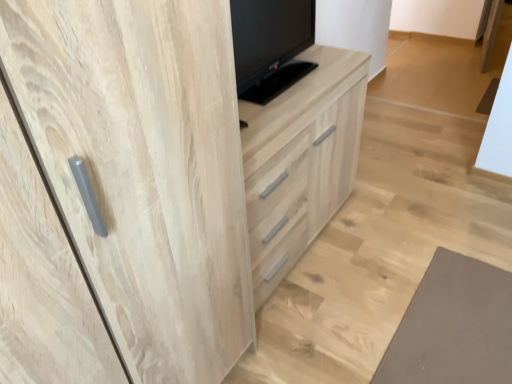
Identify the location of empty space that is to the right of light wood cabinet at center. The height and width of the screenshot is (384, 512). (411, 238).